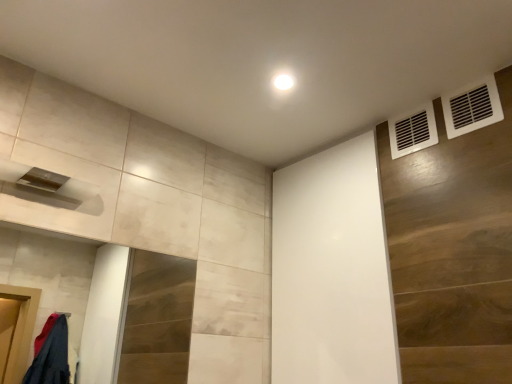
Question: Is white matte screen door at upper center completely or partially inside white plastic vent at upper right, the first air conditioning when ordered from front to back?

Choices:
 (A) no
 (B) yes

Answer: (A)

Question: From the image's perspective, would you say white plastic vent at upper right, the first air conditioning when ordered from front to back, is positioned over white matte screen door at upper center?

Choices:
 (A) yes
 (B) no

Answer: (A)

Question: Is white plastic vent at upper right, the first air conditioning when ordered from right to left, to the right of white matte screen door at upper center from the viewer's perspective?

Choices:
 (A) yes
 (B) no

Answer: (A)

Question: Is white plastic vent at upper right, acting as the second air conditioning starting from the back, further to the viewer compared to white matte screen door at upper center?

Choices:
 (A) no
 (B) yes

Answer: (A)

Question: Does white plastic vent at upper right, which is the second air conditioning in left-to-right order, appear on the left side of white matte screen door at upper center?

Choices:
 (A) yes
 (B) no

Answer: (B)

Question: From the image's perspective, is white plastic vent at upper right, the 1th air conditioning from the back, positioned above or below white matte screen door at upper center?

Choices:
 (A) below
 (B) above

Answer: (B)

Question: Based on their positions, is white plastic vent at upper right, the 1th air conditioning from the back, located to the left or right of white matte screen door at upper center?

Choices:
 (A) right
 (B) left

Answer: (A)

Question: Considering the positions of white plastic vent at upper right, the 1th air conditioning from the back, and white matte screen door at upper center in the image, is white plastic vent at upper right, the 1th air conditioning from the back, wider or thinner than white matte screen door at upper center?

Choices:
 (A) wide
 (B) thin

Answer: (B)

Question: Considering the positions of point (415, 140) and point (371, 170), is point (415, 140) closer or farther from the camera than point (371, 170)?

Choices:
 (A) closer
 (B) farther

Answer: (A)

Question: Would you say white plastic vent at upper right, positioned as the first air conditioning in left-to-right order, is inside or outside white plastic vent at upper right, the first air conditioning when ordered from front to back?

Choices:
 (A) inside
 (B) outside

Answer: (B)

Question: Is white plastic vent at upper right, the 1th air conditioning from the back, in front of or behind white plastic vent at upper right, acting as the second air conditioning starting from the back, in the image?

Choices:
 (A) behind
 (B) front

Answer: (A)

Question: From their relative heights in the image, would you say white plastic vent at upper right, the second air conditioning from the right, is taller or shorter than white plastic vent at upper right, the first air conditioning when ordered from front to back?

Choices:
 (A) short
 (B) tall

Answer: (A)

Question: Is white plastic vent at upper right, the 1th air conditioning from the back, bigger or smaller than white plastic vent at upper right, the first air conditioning when ordered from front to back?

Choices:
 (A) small
 (B) big

Answer: (B)

Question: In terms of height, does white matte screen door at upper center look taller or shorter compared to white plastic vent at upper right, acting as the second air conditioning starting from the back?

Choices:
 (A) short
 (B) tall

Answer: (B)

Question: Considering the positions of point (288, 200) and point (492, 87), is point (288, 200) closer or farther from the camera than point (492, 87)?

Choices:
 (A) closer
 (B) farther

Answer: (B)